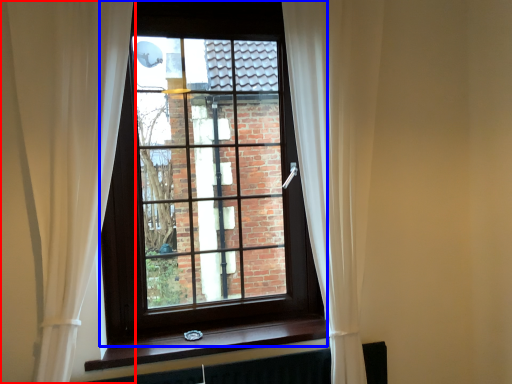
Question: Which point is closer to the camera, curtain (highlighted by a red box) or window (highlighted by a blue box)?

Choices:
 (A) curtain
 (B) window

Answer: (A)